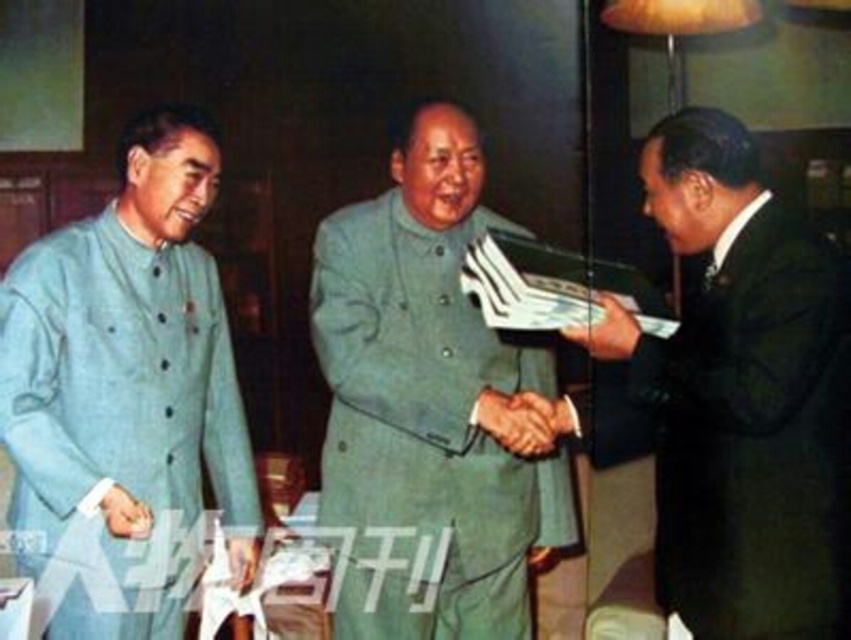
You are standing in front of the image and want to touch the point at coordinates (126, 392). Which object in the scene will your finger land on?

Your finger will land on the light blue fabric jacket at left.

Looking at this image, you are a photographer at the event and need to position a spotlight on the green matte uniform at center and the smooth leather wallet at center. According to the scene description, which object should you place the spotlight to the right of?

The smooth leather wallet at center should have the spotlight placed to its right because the green matte uniform at center is located to the left of the smooth leather wallet at center.

You are a photographer trying to capture a handshake between the light blue fabric jacket at left and the smooth skin hand at center. Can you fit both objects in the frame without cropping either?

The light blue fabric jacket at left might be wider than the smooth skin hand at center, so it is possible that the jacket occupies more space in the frame. However, since the question is about fitting both without cropping, the answer would depend on the actual dimensions. Since the description only states that the jacket might be wider, but not the exact sizes, it is uncertain. Therefore, the safest assumption is that both can fit as long as the photographer adjusts the framing to include the wider jacket